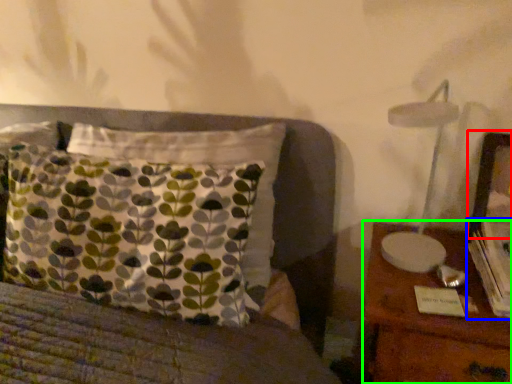
Question: Which is nearer to the picture frame (highlighted by a red box)? book (highlighted by a blue box) or nightstand (highlighted by a green box).

Choices:
 (A) book
 (B) nightstand

Answer: (A)